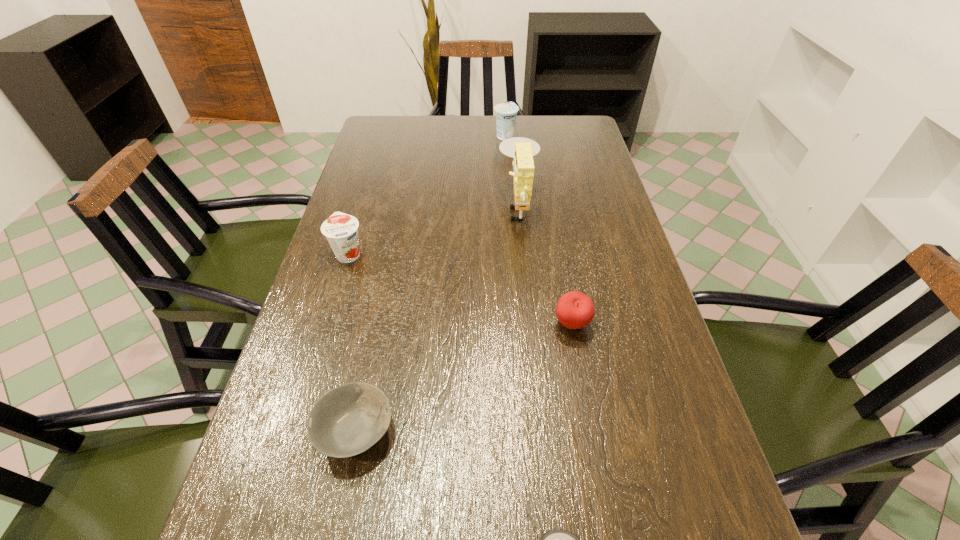
The width and height of the screenshot is (960, 540). What are the coordinates of `the third closest yogurt to the second shortest object` in the screenshot? It's located at (506, 113).

You are a GUI agent. You are given a task and a screenshot of the screen. Output one action in this format:
    pyautogui.click(x=<x>, y=<y>)
    Task: Click on the yogurt that is the third closest to the second farthest object
    
    Given the screenshot: What is the action you would take?
    pyautogui.click(x=556, y=539)

Locate an element on the screen. This screenshot has height=540, width=960. vacant space that satisfies the following two spatial constraints: 1. on the front side of the farthest yogurt; 2. on the right side of the apple is located at coordinates (520, 324).

This screenshot has width=960, height=540. I want to click on free spot that satisfies the following two spatial constraints: 1. on the front side of the second nearest yogurt; 2. on the right side of the second nearest object, so click(x=295, y=430).